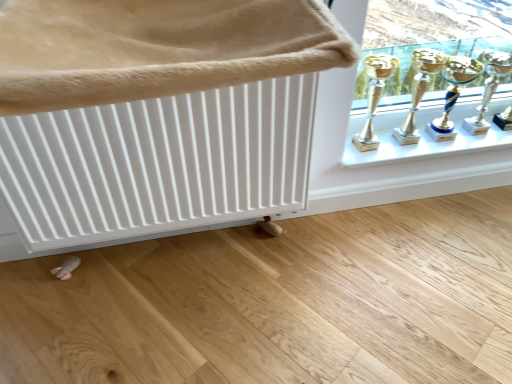
The image size is (512, 384). I want to click on free space above white glossy window sill at upper right (from a real-world perspective), so click(x=402, y=140).